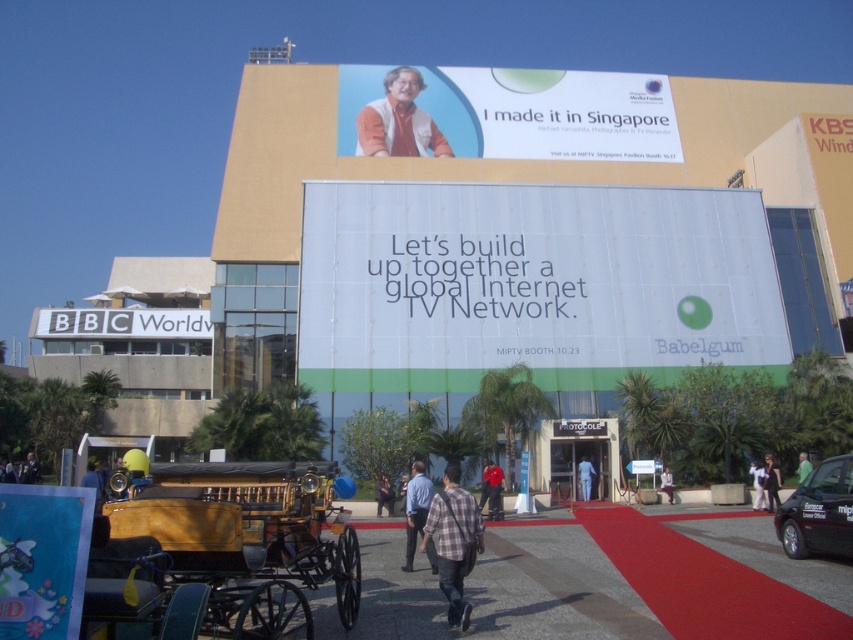
Measure the distance from wooden polished cart at lower left to white fabric person at lower right.

They are 23.51 meters apart.

Find the location of a particular element. This screenshot has width=853, height=640. wooden polished cart at lower left is located at coordinates (247, 540).

Is point (344, 541) behind point (755, 483)?

No.

Locate an element on the screen. The image size is (853, 640). wooden polished cart at lower left is located at coordinates tap(247, 540).

Is matte plastic billboard at upper center shorter than matte blue poster at lower left?

No, matte plastic billboard at upper center is not shorter than matte blue poster at lower left.

Does matte plastic billboard at upper center have a greater width compared to matte blue poster at lower left?

Correct, the width of matte plastic billboard at upper center exceeds that of matte blue poster at lower left.

Between point (337, 141) and point (21, 531), which one is positioned in front?

Point (21, 531) is more forward.

Find the location of a particular element. This screenshot has height=640, width=853. matte plastic billboard at upper center is located at coordinates (506, 113).

Is point (780, 314) positioned in front of point (799, 467)?

No.

Can you confirm if white paper billboard at center is taller than green fabric person at center?

Yes.

Is point (514, 358) positioned after point (805, 461)?

Yes, it is.

Identify the location of white paper billboard at center. The image size is (853, 640). [531, 284].